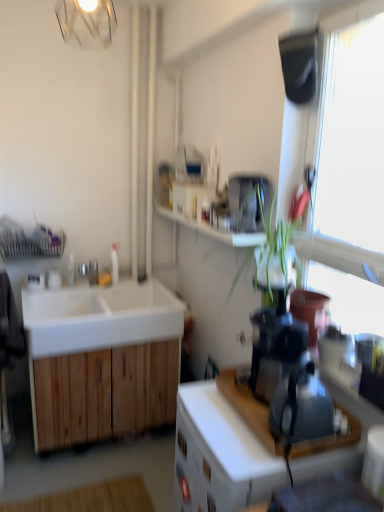
Question: From the image's perspective, is white wood cabinet at center, which is the 2th cabinetry from left to right, under white matte sink at left?

Choices:
 (A) no
 (B) yes

Answer: (B)

Question: Is the depth of white wood cabinet at center, which is the 2th cabinetry from left to right, less than that of white matte sink at left?

Choices:
 (A) no
 (B) yes

Answer: (B)

Question: From a real-world perspective, is white wood cabinet at center, the 2th cabinetry when ordered from back to front, positioned under white matte sink at left based on gravity?

Choices:
 (A) yes
 (B) no

Answer: (A)

Question: Could you tell me if white wood cabinet at center, which is counted as the first cabinetry, starting from the right, is turned towards white matte sink at left?

Choices:
 (A) yes
 (B) no

Answer: (B)

Question: Is white matte sink at left a part of white wood cabinet at center, which is counted as the first cabinetry, starting from the right?

Choices:
 (A) no
 (B) yes

Answer: (A)

Question: Which is correct: white matte drawer at center is inside white wood cabinet at left, which is the second cabinetry from right to left, or outside of it?

Choices:
 (A) outside
 (B) inside

Answer: (A)

Question: From a real-world perspective, is white matte drawer at center above or below white wood cabinet at left, the 1th cabinetry viewed from the left?

Choices:
 (A) above
 (B) below

Answer: (A)

Question: From their relative heights in the image, would you say white matte drawer at center is taller or shorter than white wood cabinet at left, the 1th cabinetry viewed from the back?

Choices:
 (A) tall
 (B) short

Answer: (B)

Question: Based on their sizes in the image, would you say white matte drawer at center is bigger or smaller than white wood cabinet at left, which is the second cabinetry from right to left?

Choices:
 (A) small
 (B) big

Answer: (A)

Question: Does point (198, 484) appear closer or farther from the camera than point (263, 425)?

Choices:
 (A) farther
 (B) closer

Answer: (A)

Question: Do you think white matte drawer at center is within white wood cabinet at center, arranged as the 1th cabinetry when viewed from the front, or outside of it?

Choices:
 (A) outside
 (B) inside

Answer: (B)

Question: From the image's perspective, is white matte drawer at center located above or below white wood cabinet at center, arranged as the 1th cabinetry when viewed from the front?

Choices:
 (A) below
 (B) above

Answer: (B)

Question: Based on their sizes in the image, would you say white matte drawer at center is bigger or smaller than white wood cabinet at center, the 2th cabinetry when ordered from back to front?

Choices:
 (A) small
 (B) big

Answer: (A)

Question: Do you think black plastic blender at right, which ranks as the second appliance in top-to-bottom order, is within dark gray fabric swivel chair at left, or outside of it?

Choices:
 (A) outside
 (B) inside

Answer: (A)

Question: Considering the relative positions of black plastic blender at right, the first appliance positioned from the front, and dark gray fabric swivel chair at left in the image provided, is black plastic blender at right, the first appliance positioned from the front, to the left or to the right of dark gray fabric swivel chair at left?

Choices:
 (A) left
 (B) right

Answer: (B)